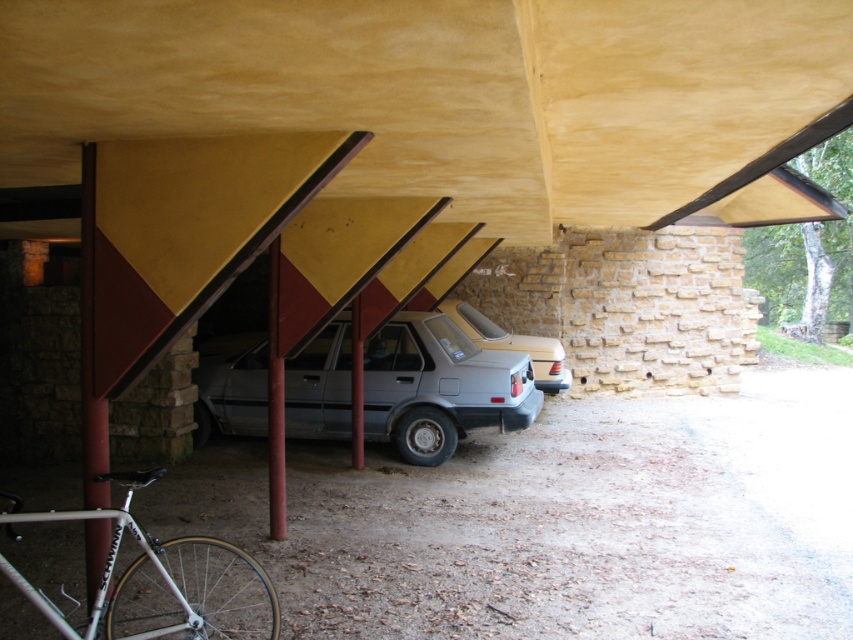
You are a delivery person trying to park your van which is 2 meters wide. You see the satin gray sedan at center and the silver metallic bicycle at lower left. Which vehicle can your van fit next to without overlapping?

The satin gray sedan at center might be wider than silver metallic bicycle at lower left, so the van can fit next to the silver metallic bicycle at lower left if there is enough space. However, since the sedan might be wider, it is safer to check the exact width before parking.

Looking at this image, you are trying to park a motorcycle that is 1.5 meters tall in the covered parking area. The motorcycle needs to fit between the silver metallic bicycle at lower left and the silver metallic sedan at center. Can the motorcycle fit vertically between them?

The silver metallic bicycle at lower left is not as tall as the silver metallic sedan at center, but the exact height difference isn not provided. However, since the sedan is taller than the bicycle, the space between them might be sufficient for the motorcycle. However, without knowing the exact height of the sedan or the required clearance, it is uncertain if the motorcycle will fit vertically.